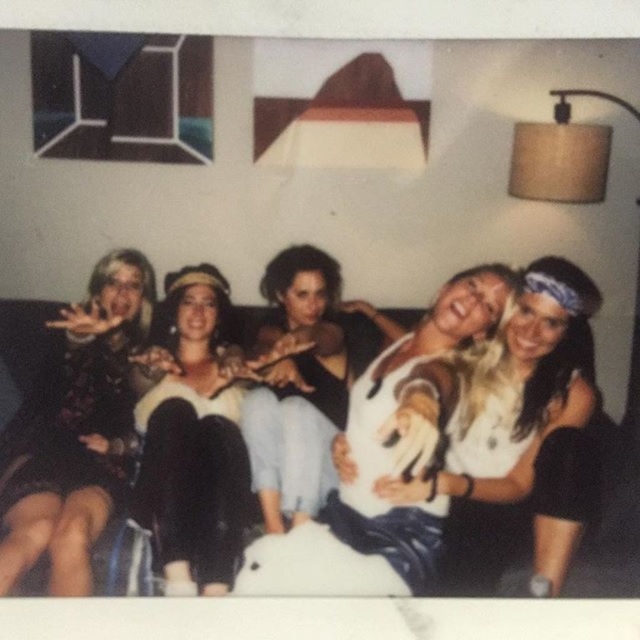
Question: Observing the image, what is the correct spatial positioning of white cotton shirt at center in reference to black velvet dress at center?

Choices:
 (A) right
 (B) left

Answer: (A)

Question: Which of the following is the closest to the observer?

Choices:
 (A) (28, 436)
 (B) (0, 378)
 (C) (458, 541)

Answer: (B)

Question: Can you confirm if white fabric at center is positioned to the right of black fabric couch at center?

Choices:
 (A) no
 (B) yes

Answer: (B)

Question: Based on their relative distances, which object is nearer to the black velvet dress at center?

Choices:
 (A) matte black sweater at center
 (B) black fabric couch at center
 (C) white cotton shirt at center
 (D) white fabric at center

Answer: (A)

Question: Which object appears closest to the camera in this image?

Choices:
 (A) matte floral dress at left
 (B) black velvet dress at center

Answer: (A)

Question: Where is white fabric at center located in relation to matte floral dress at left in the image?

Choices:
 (A) above
 (B) below

Answer: (A)